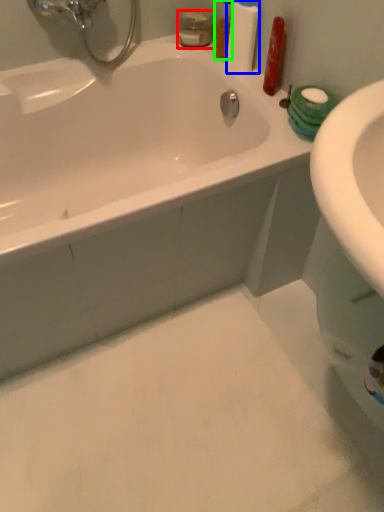
Question: Estimate the real-world distances between objects in this image. Which object is farther from mouthwash (highlighted by a red box), cleaning product (highlighted by a blue box) or mouthwash (highlighted by a green box)?

Choices:
 (A) cleaning product
 (B) mouthwash

Answer: (A)